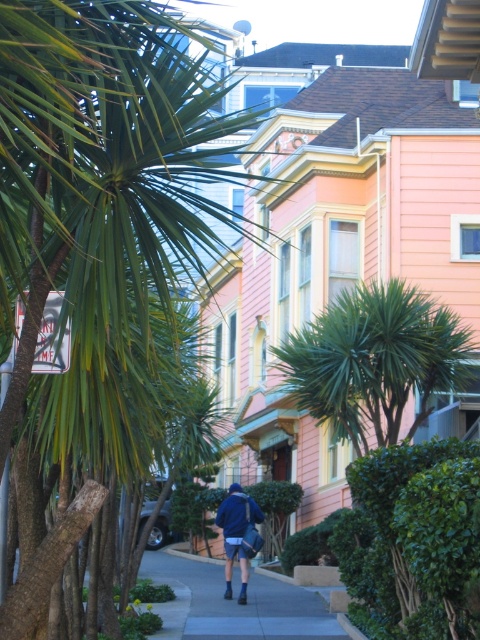
Question: Which object is closer to the camera taking this photo?

Choices:
 (A) green leafy palm tree at center
 (B) blue fabric jacket at center

Answer: (A)

Question: From the image, what is the correct spatial relationship of green leafy palm tree at center in relation to blue fabric jacket at center?

Choices:
 (A) below
 (B) above

Answer: (B)

Question: Is green leafy palm tree at center closer to camera compared to blue fabric jacket at center?

Choices:
 (A) yes
 (B) no

Answer: (A)

Question: Which point is closer to the camera?

Choices:
 (A) blue fabric jacket at center
 (B) green leafy palm tree at center

Answer: (B)

Question: Does green leafy palm tree at center appear over blue fabric jacket at center?

Choices:
 (A) yes
 (B) no

Answer: (A)